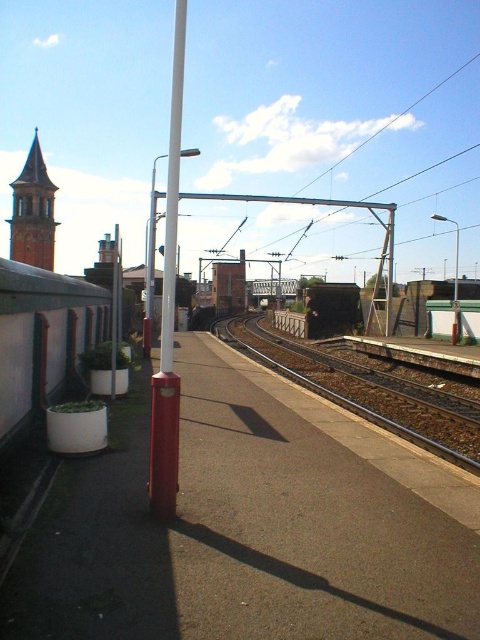
Question: Where is white concrete platform at lower left located in relation to brown gravel train track at center in the image?

Choices:
 (A) right
 (B) left

Answer: (A)

Question: Can you confirm if white concrete platform at lower left is bigger than white glossy pole at center?

Choices:
 (A) yes
 (B) no

Answer: (B)

Question: Which point is closer to the camera?

Choices:
 (A) (162, 369)
 (B) (365, 612)
 (C) (377, 397)

Answer: (B)

Question: Does white concrete platform at lower left come behind brown gravel train track at center?

Choices:
 (A) no
 (B) yes

Answer: (A)

Question: Which point is farther to the camera?

Choices:
 (A) white concrete platform at lower left
 (B) brown gravel train track at center
 (C) white glossy pole at center

Answer: (B)

Question: Which point appears closest to the camera in this image?

Choices:
 (A) (386, 513)
 (B) (360, 385)

Answer: (A)